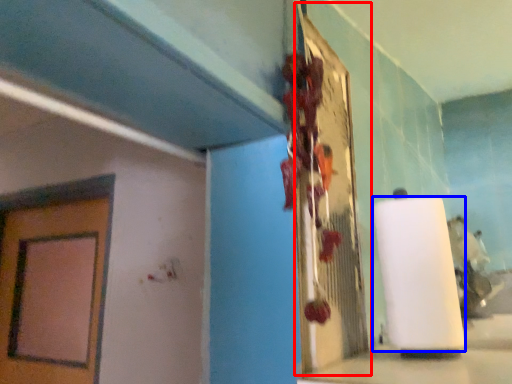
Question: Which object appears farthest to the camera in this image, bulletin board (highlighted by a red box) or paper towel (highlighted by a blue box)?

Choices:
 (A) bulletin board
 (B) paper towel

Answer: (B)